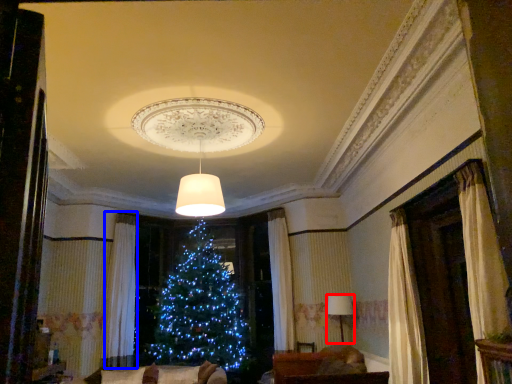
Question: Which point is further to the camera, lamp (highlighted by a red box) or curtain (highlighted by a blue box)?

Choices:
 (A) lamp
 (B) curtain

Answer: (B)